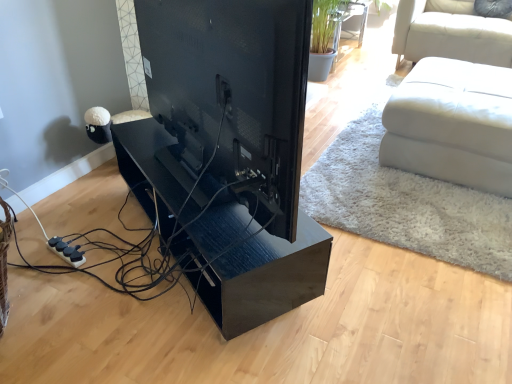
Question: Does glossy wood table at center come in front of white leather ottoman at right?

Choices:
 (A) yes
 (B) no

Answer: (A)

Question: Does glossy wood table at center have a greater height compared to white leather ottoman at right?

Choices:
 (A) yes
 (B) no

Answer: (B)

Question: Is glossy wood table at center facing towards white leather ottoman at right?

Choices:
 (A) yes
 (B) no

Answer: (A)

Question: Is glossy wood table at center not near white leather ottoman at right?

Choices:
 (A) yes
 (B) no

Answer: (A)

Question: From a real-world perspective, is glossy wood table at center physically below white leather ottoman at right?

Choices:
 (A) yes
 (B) no

Answer: (A)

Question: Is glossy wood table at center inside the boundaries of white leather ottoman at right, or outside?

Choices:
 (A) inside
 (B) outside

Answer: (B)

Question: From the image's perspective, is glossy wood table at center above or below white leather ottoman at right?

Choices:
 (A) above
 (B) below

Answer: (B)

Question: In terms of height, does glossy wood table at center look taller or shorter compared to white leather ottoman at right?

Choices:
 (A) short
 (B) tall

Answer: (A)

Question: Relative to white leather ottoman at right, is glossy wood table at center in front or behind?

Choices:
 (A) front
 (B) behind

Answer: (A)

Question: Based on their positions, is white leather ottoman at right located to the left or right of black glossy tv at center?

Choices:
 (A) right
 (B) left

Answer: (A)

Question: From the image's perspective, relative to black glossy tv at center, is white leather ottoman at right above or below?

Choices:
 (A) below
 (B) above

Answer: (B)

Question: Relative to black glossy tv at center, is white leather ottoman at right in front or behind?

Choices:
 (A) behind
 (B) front

Answer: (A)

Question: From their relative heights in the image, would you say white leather ottoman at right is taller or shorter than black glossy tv at center?

Choices:
 (A) tall
 (B) short

Answer: (B)

Question: Visually, is black glossy tv at center positioned to the left or to the right of glossy wood table at center?

Choices:
 (A) left
 (B) right

Answer: (A)

Question: Is point (278, 162) closer or farther from the camera than point (212, 210)?

Choices:
 (A) closer
 (B) farther

Answer: (A)